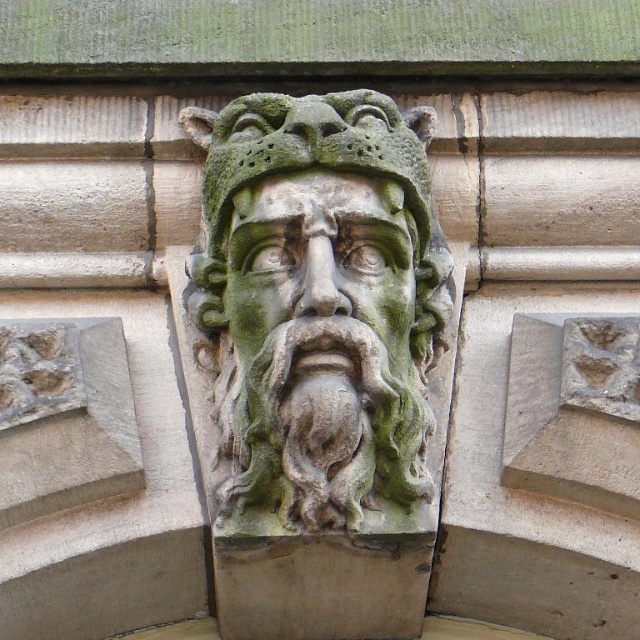
Question: Which object appears farthest from the camera in this image?

Choices:
 (A) green stone head at center
 (B) green stone face at center

Answer: (B)

Question: Is green stone head at center above green stone face at center?

Choices:
 (A) no
 (B) yes

Answer: (B)

Question: Does green stone head at center have a greater width compared to green stone face at center?

Choices:
 (A) yes
 (B) no

Answer: (A)

Question: Which object appears closest to the camera in this image?

Choices:
 (A) green stone face at center
 (B) green stone head at center

Answer: (B)

Question: Which of the following is the closest to the observer?

Choices:
 (A) (317, 179)
 (B) (266, 328)

Answer: (B)

Question: Does green stone head at center come in front of green stone face at center?

Choices:
 (A) no
 (B) yes

Answer: (B)